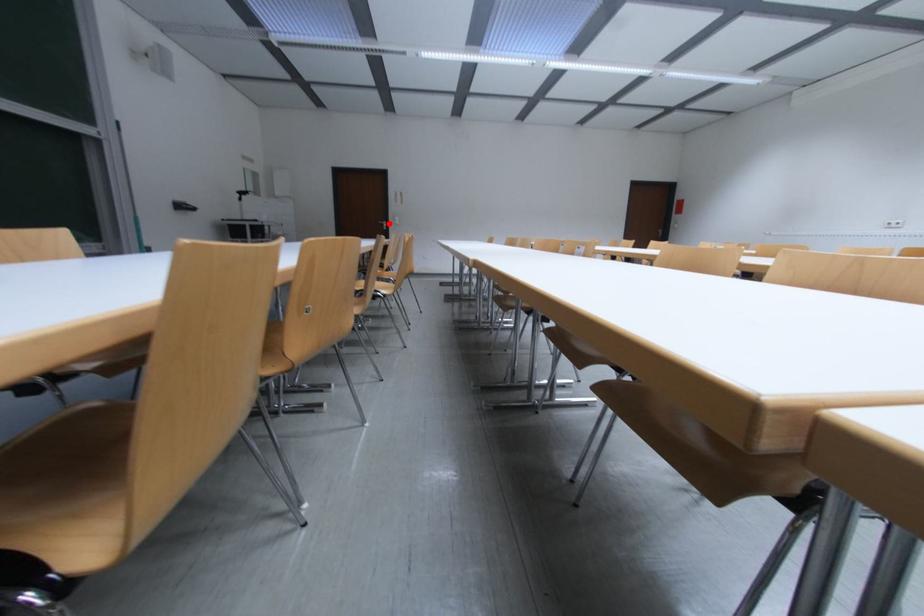
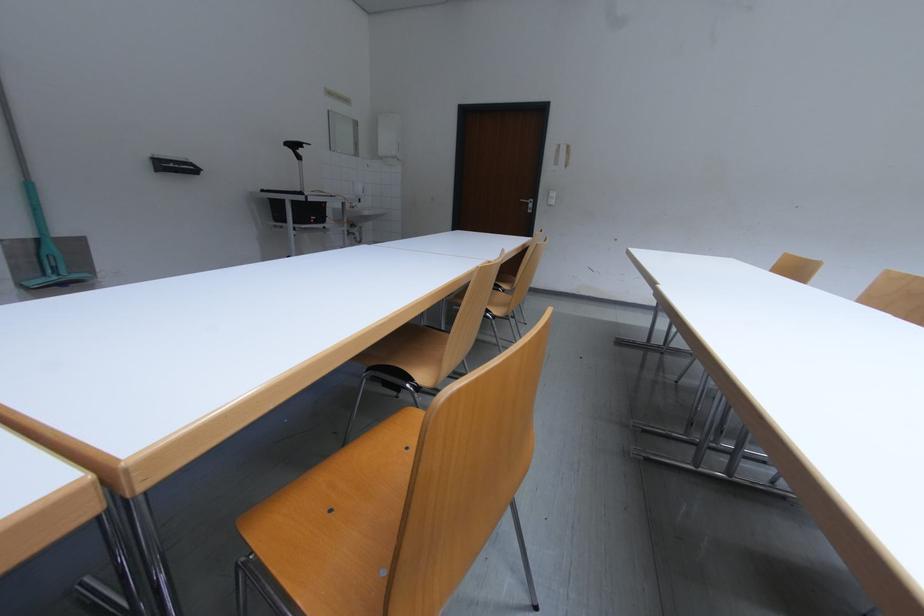
Locate, in the second image, the point that corresponds to the highlighted location in the first image.

(531, 201)